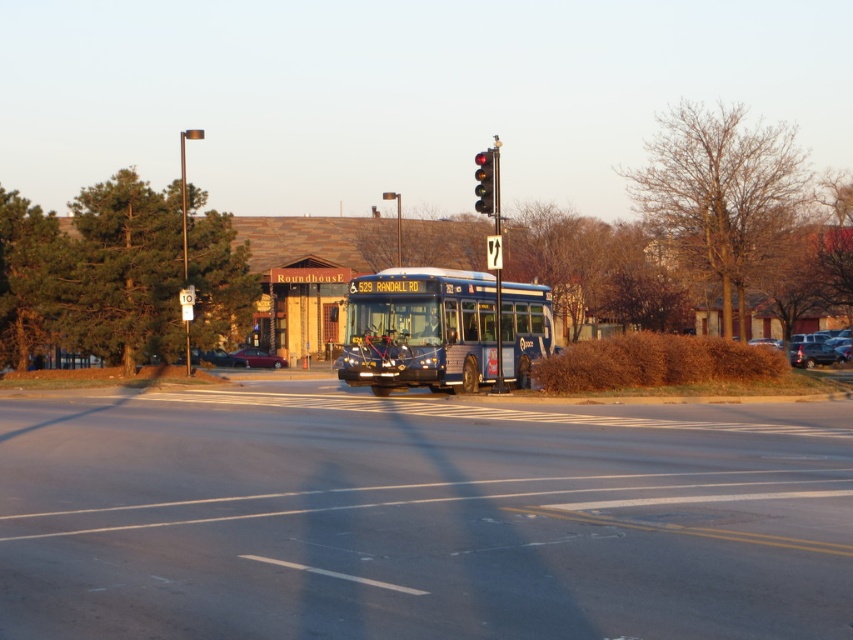
From the picture: You are a pedestrian standing at the crosswalk on the left side of the road. You need to cross to the other side, but there is a matte black suv at right. Based on the position of the traffic signal and the suv, which direction is the suv most likely heading?

The matte black suv at right is located at point (810, 348), which is near the right side of the image. Since the traffic signal shows a red light for straight traffic, the suv might be preparing to turn right or is stopped at the light. However, without more information on its direction indicators, we can only infer it could be waiting to turn right or proceeding if the light turns green. But based on the given data, the suv is positioned at the right lane, so it is likely heading straight or turning if

You are a pedestrian waiting to cross the street. You see a blue metallic bus at center and a matte black suv at right. Which vehicle is closer to the left side of the road?

The blue metallic bus at center is closer to the left side of the road because it is positioned to the left of the matte black suv at right.